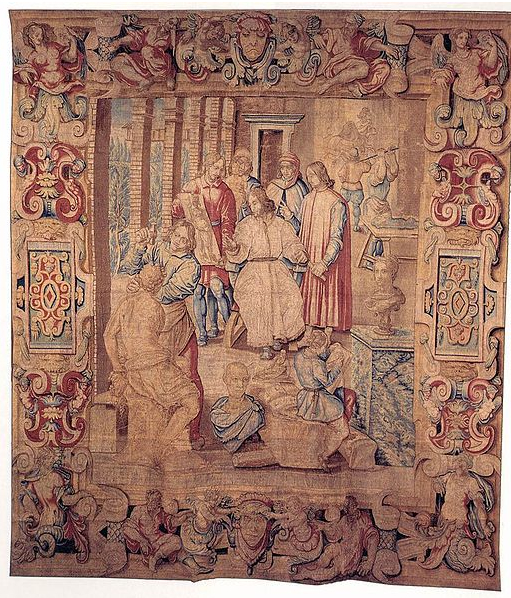
At what (x,y) coordinates should I click in order to perform the action: click on tapestry art. Please return your answer as a coordinate pair (x, y). This screenshot has width=511, height=598. Looking at the image, I should click on coord(251,294).